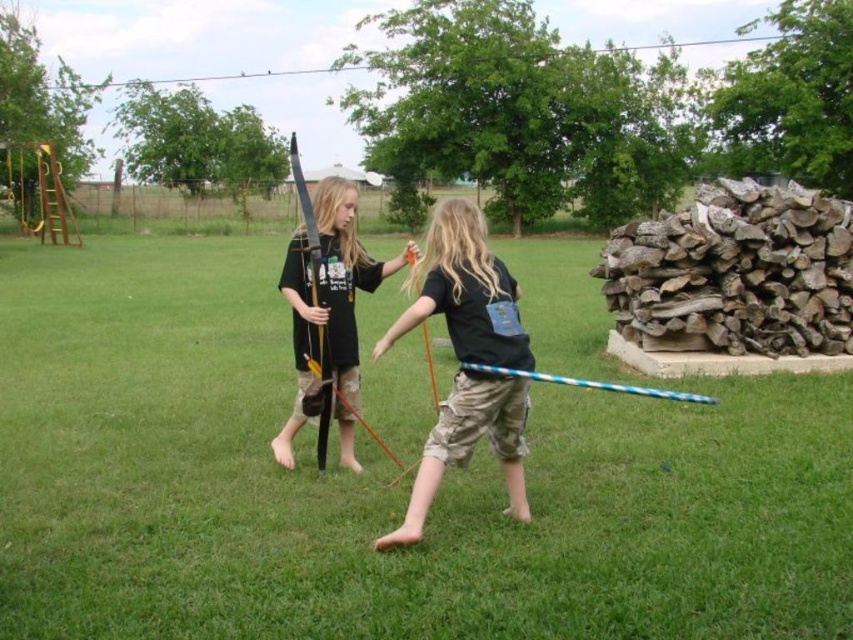
Question: Can you confirm if green grass at center is thinner than black matte hula hoop at center?

Choices:
 (A) yes
 (B) no

Answer: (B)

Question: Which point appears farthest from the camera in this image?

Choices:
 (A) (355, 378)
 (B) (460, 348)
 (C) (738, 632)

Answer: (A)

Question: Which point is farther from the camera taking this photo?

Choices:
 (A) (138, 294)
 (B) (354, 230)

Answer: (A)

Question: Can you confirm if green grass at center is positioned below matte black bow at center?

Choices:
 (A) yes
 (B) no

Answer: (A)

Question: Does black matte hula hoop at center lie behind matte black bow at center?

Choices:
 (A) no
 (B) yes

Answer: (A)

Question: Estimate the real-world distances between objects in this image. Which object is closer to the green grass at center?

Choices:
 (A) black matte hula hoop at center
 (B) matte black bow at center

Answer: (A)